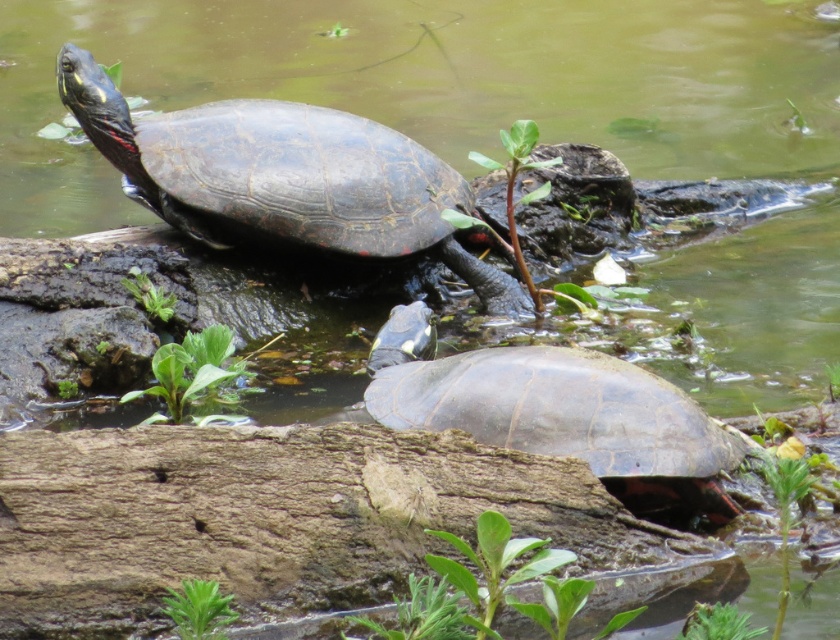
Question: Can you confirm if shiny dark turtle at upper left is thinner than shiny dark gray tortoise at center?

Choices:
 (A) no
 (B) yes

Answer: (A)

Question: Is shiny dark turtle at upper left behind shiny dark gray tortoise at center?

Choices:
 (A) no
 (B) yes

Answer: (B)

Question: Which of the following is the closest to the observer?

Choices:
 (A) (655, 465)
 (B) (235, 195)

Answer: (A)

Question: Which object is farther from the camera taking this photo?

Choices:
 (A) shiny dark turtle at upper left
 (B) shiny dark gray tortoise at center

Answer: (A)

Question: Is shiny dark turtle at upper left above shiny dark gray tortoise at center?

Choices:
 (A) no
 (B) yes

Answer: (B)